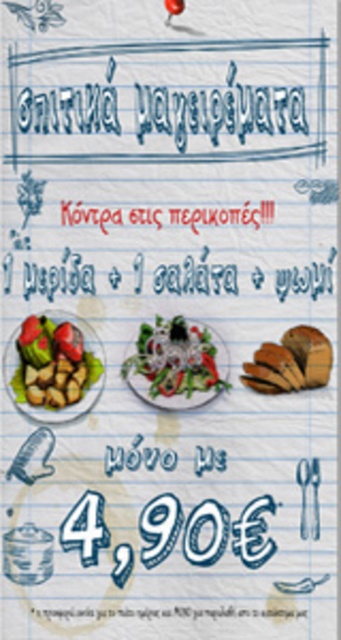
Question: In this image, where is white paper text at center located relative to golden brown bread at center right?

Choices:
 (A) above
 (B) below

Answer: (A)

Question: In this image, where is brown matte/rough potatoes at left located relative to green leafy salad at center?

Choices:
 (A) left
 (B) right

Answer: (A)

Question: Which of the following is the closest to the observer?

Choices:
 (A) (x=82, y=266)
 (B) (x=51, y=349)
 (C) (x=158, y=364)

Answer: (B)

Question: Which is nearer to the white paper text at center?

Choices:
 (A) brown matte/rough potatoes at left
 (B) red matte tomato at center
 (C) green leafy salad at center
 (D) golden brown bread at center right

Answer: (C)

Question: Which of the following is the farthest from the observer?

Choices:
 (A) (47, 273)
 (B) (168, 16)
 (C) (173, 340)

Answer: (C)

Question: Is the position of white paper text at center less distant than that of brown matte/rough potatoes at left?

Choices:
 (A) no
 (B) yes

Answer: (A)